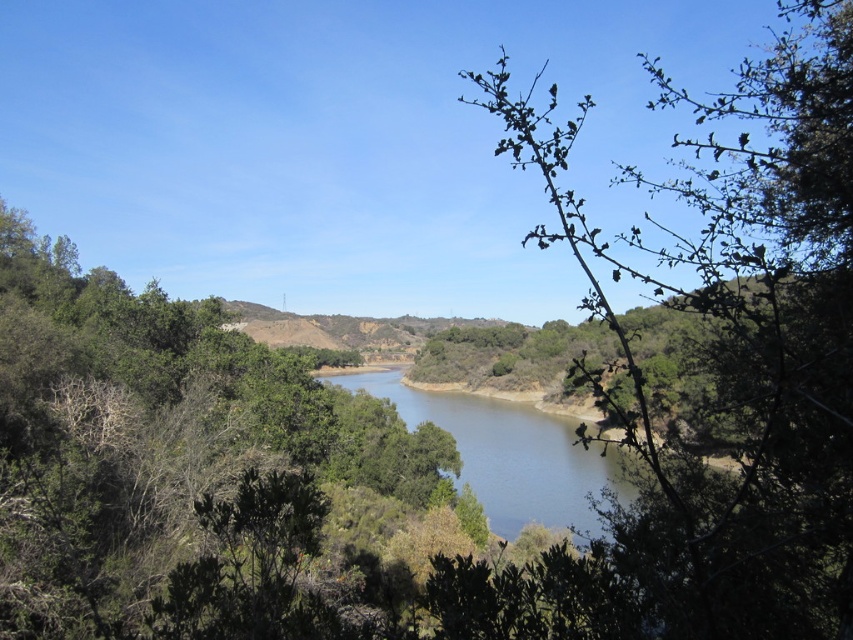
Does point (671, 248) come closer to viewer compared to point (511, 525)?

No, (671, 248) is behind (511, 525).

Identify the location of green leafy branch at center. (721, 385).